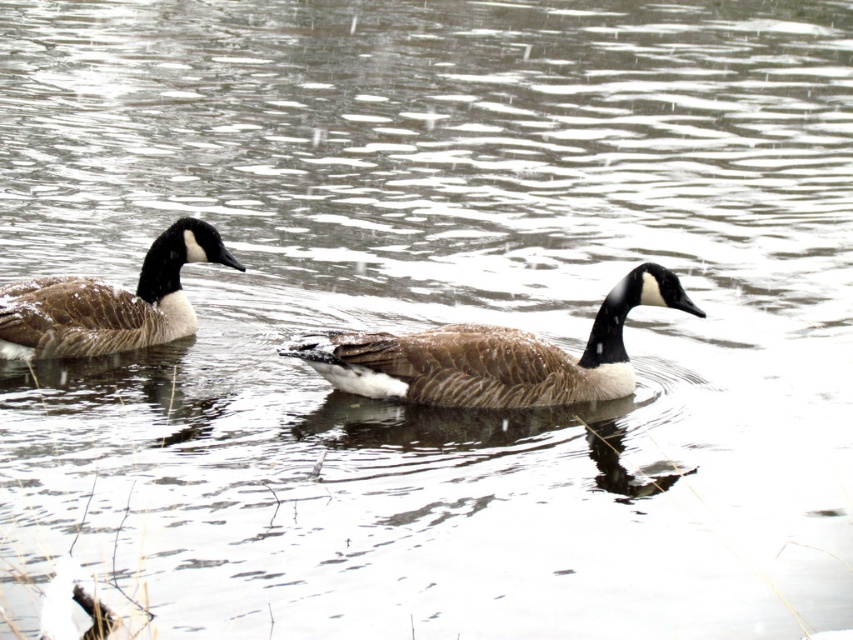
Between point (338, 387) and point (67, 276), which one is positioned behind?

Point (67, 276)

Consider the image. Is brown feathered duck at center wider than brown feathered duck at left?

Yes, brown feathered duck at center is wider than brown feathered duck at left.

What do you see at coordinates (495, 356) in the screenshot? The height and width of the screenshot is (640, 853). I see `brown feathered duck at center` at bounding box center [495, 356].

Image resolution: width=853 pixels, height=640 pixels. Find the location of `brown feathered duck at center`. brown feathered duck at center is located at coordinates (495, 356).